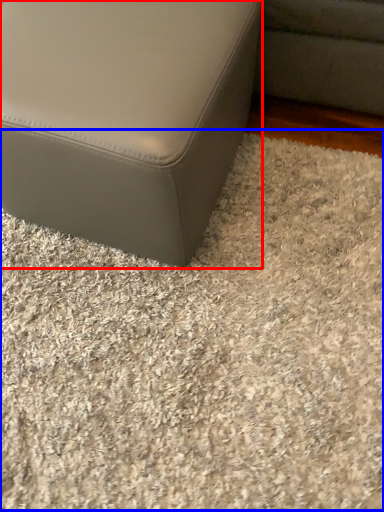
Question: Which object is closer to the camera taking this photo, furniture (highlighted by a red box) or gravel (highlighted by a blue box)?

Choices:
 (A) furniture
 (B) gravel

Answer: (A)